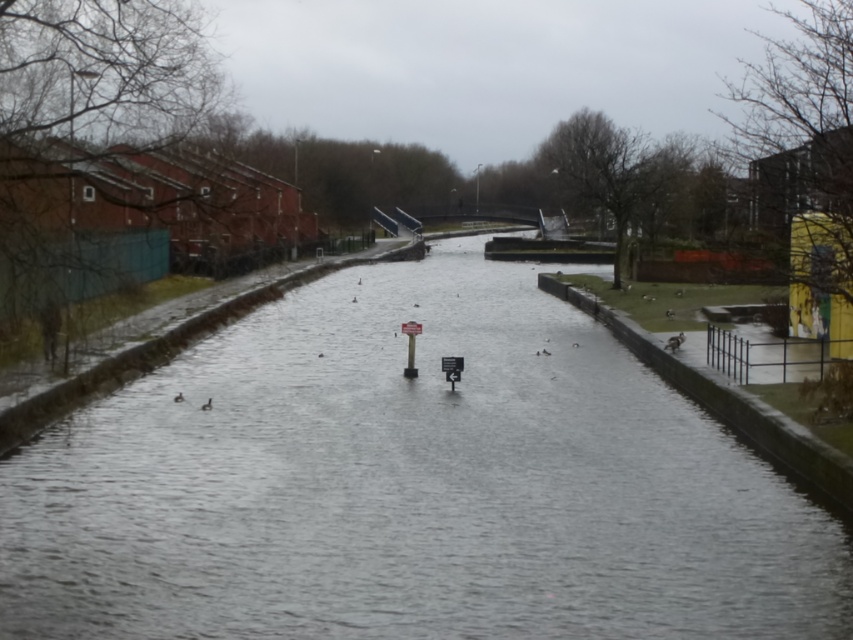
You are standing on the paved pathway next to the smooth concrete canal at center and want to reach the metallic gray signpost at center. Which direction should you move towards?

You should move towards the right to reach the metallic gray signpost at center because the smooth concrete canal at center is located to its left.

You are a tourist navigating a canal path and see the metallic street sign at center and the metallic gray signpost at center. According to their positions, which one is located to the left?

The metallic street sign at center is positioned on the left side of the metallic gray signpost at center, so it is located to the left.

You are a tourist holding a map and looking at the smooth concrete canal at center and the metallic gray signpost at center. According to the map, which one is positioned lower in the scene?

The smooth concrete canal at center is located below the metallic gray signpost at center, so the smooth concrete canal at center is positioned lower in the scene.